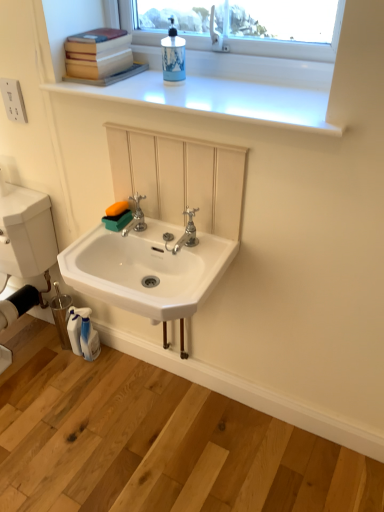
Image resolution: width=384 pixels, height=512 pixels. Identify the location of vacant space situated on the left part of blue ceramic soap dispenser at upper center. (127, 84).